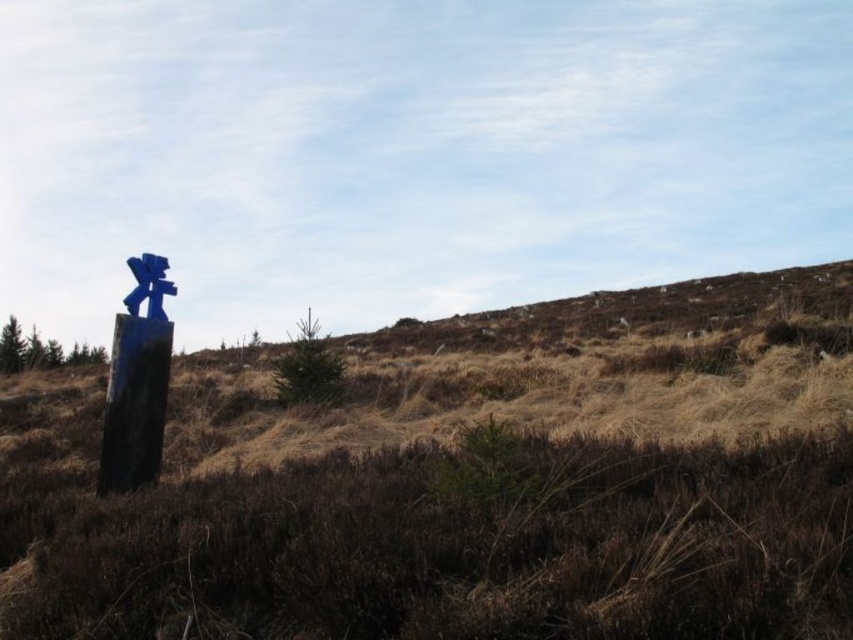
Question: Can you confirm if brown dry grass at left is bigger than blue painted wood signpost at left?

Choices:
 (A) no
 (B) yes

Answer: (B)

Question: Considering the real-world distances, which object is closest to the blue painted wood signpost at left?

Choices:
 (A) matte blue signpost at center-left
 (B) brown dry grass at left

Answer: (A)

Question: Can you confirm if brown dry grass at left is positioned to the left of matte blue signpost at center-left?

Choices:
 (A) yes
 (B) no

Answer: (B)

Question: Which object appears farthest from the camera in this image?

Choices:
 (A) matte blue signpost at center-left
 (B) blue painted wood signpost at left

Answer: (B)

Question: Does matte blue signpost at center-left have a smaller size compared to blue painted wood signpost at left?

Choices:
 (A) yes
 (B) no

Answer: (B)

Question: Which object appears farthest from the camera in this image?

Choices:
 (A) matte blue signpost at center-left
 (B) brown dry grass at left

Answer: (A)